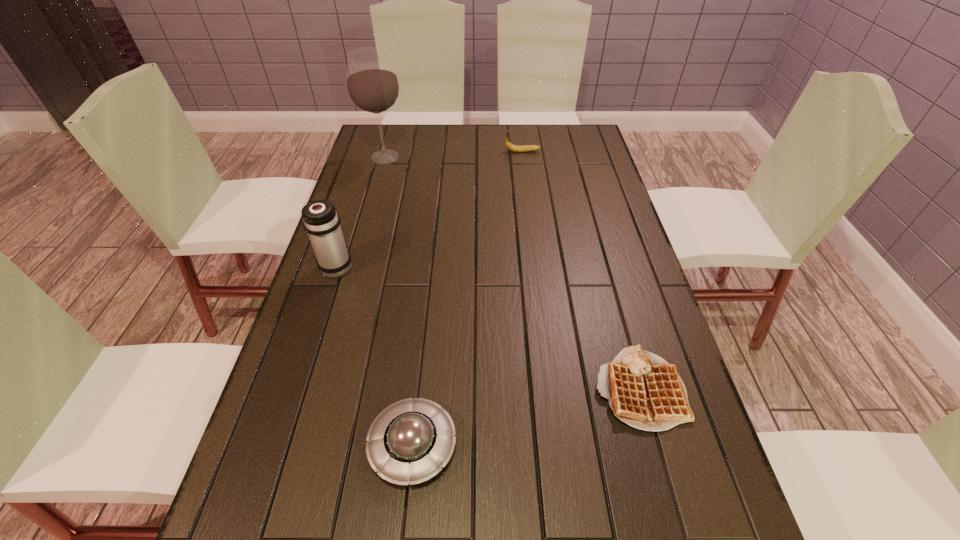
The height and width of the screenshot is (540, 960). I want to click on free point that satisfies the following two spatial constraints: 1. at the stem of the banana; 2. on the front side of the tallest object, so click(523, 157).